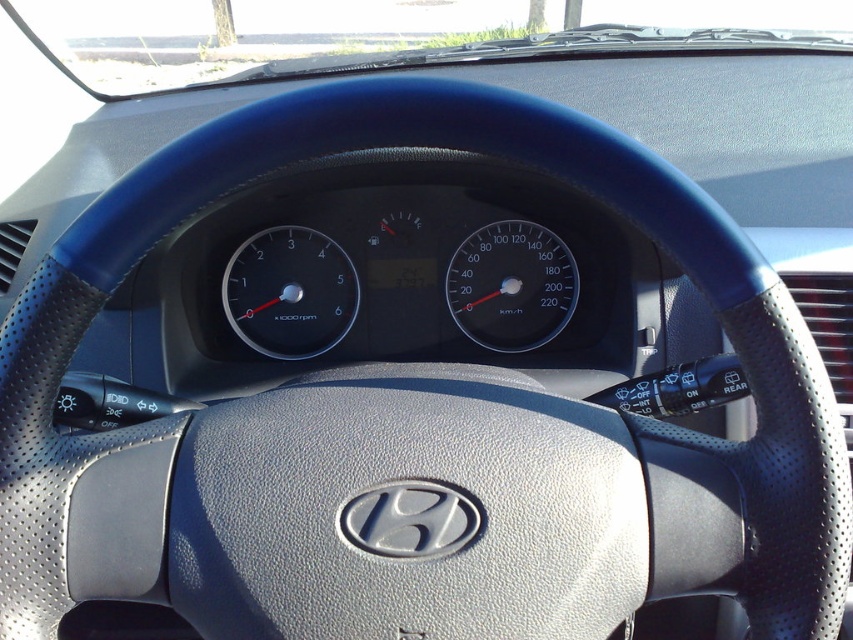
Question: Which point appears farthest from the camera in this image?

Choices:
 (A) (524, 227)
 (B) (291, 285)

Answer: (A)

Question: Is black leather speedometer at center positioned before transparent glass speedometer at center?

Choices:
 (A) no
 (B) yes

Answer: (B)

Question: Observing the image, what is the correct spatial positioning of black leather speedometer at center in reference to transparent glass speedometer at center?

Choices:
 (A) above
 (B) below

Answer: (B)

Question: Among these objects, which one is nearest to the camera?

Choices:
 (A) black leather speedometer at center
 (B) transparent glass speedometer at center

Answer: (A)

Question: Is black leather speedometer at center positioned before transparent glass speedometer at center?

Choices:
 (A) yes
 (B) no

Answer: (A)